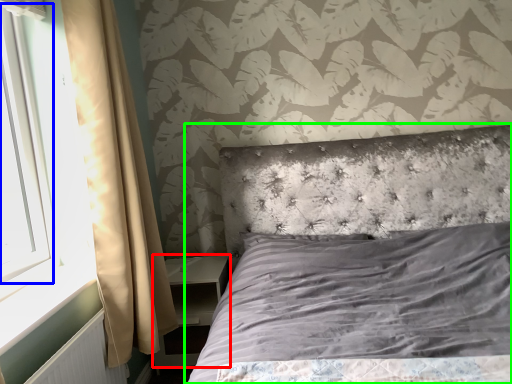
Question: Estimate the real-world distances between objects in this image. Which object is farther from nightstand (highlighted by a red box), window screen (highlighted by a blue box) or bed (highlighted by a green box)?

Choices:
 (A) window screen
 (B) bed

Answer: (A)